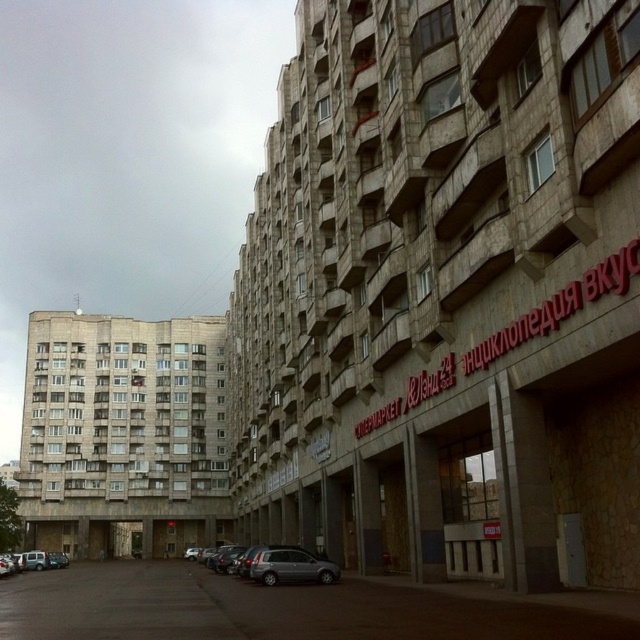
Question: Does silver metallic car at lower center have a larger size compared to silver metallic car at lower left?

Choices:
 (A) yes
 (B) no

Answer: (B)

Question: Which of the following is the closest to the observer?

Choices:
 (A) click(337, 564)
 (B) click(16, 556)

Answer: (A)

Question: Does silver metallic car at lower center appear over silver metallic car at lower left?

Choices:
 (A) no
 (B) yes

Answer: (B)

Question: Which of the following is the closest to the observer?

Choices:
 (A) (49, 554)
 (B) (323, 576)

Answer: (B)

Question: Can you confirm if silver metallic car at lower center is positioned below silver metallic car at lower left?

Choices:
 (A) no
 (B) yes

Answer: (A)